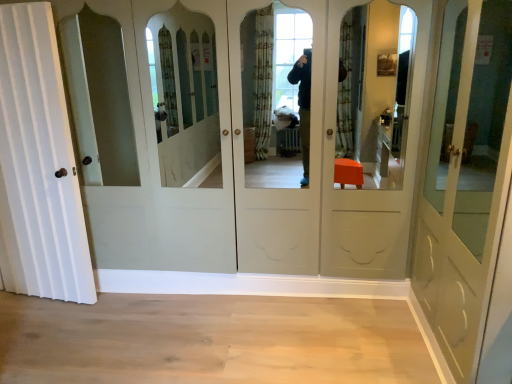
You are a GUI agent. You are given a task and a screenshot of the screen. Output one action in this format:
    pyautogui.click(x=<x>, y=<y>)
    Task: Click on the white wood door at left, placed as the 1th door when sorted from left to right
    
    Given the screenshot: What is the action you would take?
    pyautogui.click(x=38, y=165)

This screenshot has height=384, width=512. What do you see at coordinates (38, 165) in the screenshot? I see `white wood door at left, the second door from the right` at bounding box center [38, 165].

What is the approximate width of white wood door at left, placed as the 1th door when sorted from left to right?

The width of white wood door at left, placed as the 1th door when sorted from left to right, is 7.27 inches.

At what (x,y) coordinates should I click in order to perform the action: click on matte white door at right, the 2th door positioned from the left. Please return your answer as a coordinate pair (x, y). Image resolution: width=512 pixels, height=384 pixels. Looking at the image, I should click on (465, 179).

Looking at this image, how much space does matte white door at right, which is counted as the first door, starting from the right, occupy vertically?

6.21 feet.

Image resolution: width=512 pixels, height=384 pixels. Describe the element at coordinates (465, 179) in the screenshot. I see `matte white door at right, which is counted as the first door, starting from the right` at that location.

Measure the distance between matte white door at right, the 2th door positioned from the left, and camera.

matte white door at right, the 2th door positioned from the left, is 4.78 feet away from camera.

Find the location of a particular element. The height and width of the screenshot is (384, 512). white wood door at left, the second door from the right is located at coordinates (38, 165).

Considering the positions of objects matte white door at right, the 2th door positioned from the left, and white wood door at left, the second door from the right, in the image provided, who is more to the left, matte white door at right, the 2th door positioned from the left, or white wood door at left, the second door from the right,?

white wood door at left, the second door from the right.

Consider the image. Considering the relative positions of matte white door at right, the 2th door positioned from the left, and white wood door at left, placed as the 1th door when sorted from left to right, in the image provided, is matte white door at right, the 2th door positioned from the left, behind white wood door at left, placed as the 1th door when sorted from left to right,?

No, matte white door at right, the 2th door positioned from the left, is in front of white wood door at left, placed as the 1th door when sorted from left to right.

Considering the positions of point (478, 157) and point (17, 122), is point (478, 157) closer or farther from the camera than point (17, 122)?

Point (478, 157) is closer to the camera than point (17, 122).

From the image's perspective, relative to white wood door at left, placed as the 1th door when sorted from left to right, is matte white door at right, the 2th door positioned from the left, above or below?

matte white door at right, the 2th door positioned from the left, is below white wood door at left, placed as the 1th door when sorted from left to right.

From a real-world perspective, is matte white door at right, the 2th door positioned from the left, located beneath white wood door at left, the second door from the right?

No.

Considering the sizes of matte white door at right, the 2th door positioned from the left, and white wood door at left, the second door from the right, in the image, is matte white door at right, the 2th door positioned from the left, wider or thinner than white wood door at left, the second door from the right,?

Clearly, matte white door at right, the 2th door positioned from the left, has more width compared to white wood door at left, the second door from the right.

Consider the image. Considering the sizes of objects matte white door at right, which is counted as the first door, starting from the right, and white wood door at left, the second door from the right, in the image provided, who is shorter, matte white door at right, which is counted as the first door, starting from the right, or white wood door at left, the second door from the right,?

With less height is matte white door at right, which is counted as the first door, starting from the right.

Considering the relative sizes of matte white door at right, which is counted as the first door, starting from the right, and white wood door at left, placed as the 1th door when sorted from left to right, in the image provided, is matte white door at right, which is counted as the first door, starting from the right, bigger than white wood door at left, placed as the 1th door when sorted from left to right,?

Indeed, matte white door at right, which is counted as the first door, starting from the right, has a larger size compared to white wood door at left, placed as the 1th door when sorted from left to right.

Is matte white door at right, which is counted as the first door, starting from the right, outside of white wood door at left, the second door from the right?

That's correct, matte white door at right, which is counted as the first door, starting from the right, is outside of white wood door at left, the second door from the right.

Is matte white door at right, which is counted as the first door, starting from the right, not close to white wood door at left, the second door from the right?

Yes, matte white door at right, which is counted as the first door, starting from the right, and white wood door at left, the second door from the right, are located far from each other.

Is matte white door at right, which is counted as the first door, starting from the right, aimed at white wood door at left, placed as the 1th door when sorted from left to right?

Yes, matte white door at right, which is counted as the first door, starting from the right, faces towards white wood door at left, placed as the 1th door when sorted from left to right.

How different are the orientations of matte white door at right, the 2th door positioned from the left, and white wood door at left, the second door from the right, in degrees?

79.9 degrees separate the facing orientations of matte white door at right, the 2th door positioned from the left, and white wood door at left, the second door from the right.

Identify the location of door below the white wood door at left, placed as the 1th door when sorted from left to right (from the image's perspective). (465, 179).

Is white wood door at left, placed as the 1th door when sorted from left to right, at the right side of matte white door at right, which is counted as the first door, starting from the right?

Incorrect, white wood door at left, placed as the 1th door when sorted from left to right, is not on the right side of matte white door at right, which is counted as the first door, starting from the right.

Is white wood door at left, placed as the 1th door when sorted from left to right, closer to the viewer compared to matte white door at right, the 2th door positioned from the left?

No, the depth of white wood door at left, placed as the 1th door when sorted from left to right, is greater than that of matte white door at right, the 2th door positioned from the left.

Is point (12, 113) closer or farther from the camera than point (462, 343)?

Point (12, 113) is farther from the camera than point (462, 343).

From the image's perspective, which one is positioned lower, white wood door at left, the second door from the right, or matte white door at right, which is counted as the first door, starting from the right?

matte white door at right, which is counted as the first door, starting from the right, is shown below in the image.

From a real-world perspective, is white wood door at left, the second door from the right, under matte white door at right, which is counted as the first door, starting from the right?

Indeed, from a real-world perspective, white wood door at left, the second door from the right, is positioned beneath matte white door at right, which is counted as the first door, starting from the right.

Is white wood door at left, placed as the 1th door when sorted from left to right, thinner than matte white door at right, the 2th door positioned from the left?

Yes, white wood door at left, placed as the 1th door when sorted from left to right, is thinner than matte white door at right, the 2th door positioned from the left.

Considering the relative sizes of white wood door at left, the second door from the right, and matte white door at right, the 2th door positioned from the left, in the image provided, is white wood door at left, the second door from the right, taller than matte white door at right, the 2th door positioned from the left,?

Yes, white wood door at left, the second door from the right, is taller than matte white door at right, the 2th door positioned from the left.

Between white wood door at left, the second door from the right, and matte white door at right, which is counted as the first door, starting from the right, which one has smaller size?

With smaller size is white wood door at left, the second door from the right.

Would you say white wood door at left, the second door from the right, contains matte white door at right, which is counted as the first door, starting from the right?

Definitely not — matte white door at right, which is counted as the first door, starting from the right, is not inside white wood door at left, the second door from the right.

Is white wood door at left, the second door from the right, next to matte white door at right, the 2th door positioned from the left, and touching it?

No, white wood door at left, the second door from the right, is not next to matte white door at right, the 2th door positioned from the left.

In the scene shown: Is white wood door at left, placed as the 1th door when sorted from left to right, oriented towards matte white door at right, the 2th door positioned from the left?

No, white wood door at left, placed as the 1th door when sorted from left to right, is not facing towards matte white door at right, the 2th door positioned from the left.

What's the angular difference between white wood door at left, the second door from the right, and matte white door at right, the 2th door positioned from the left,'s facing directions?

The angle between the facing direction of white wood door at left, the second door from the right, and the facing direction of matte white door at right, the 2th door positioned from the left, is 79.9 degrees.

Locate an element on the screen. The width and height of the screenshot is (512, 384). door lying on the right of white wood door at left, placed as the 1th door when sorted from left to right is located at coordinates (465, 179).

The width and height of the screenshot is (512, 384). Find the location of `door below the white wood door at left, placed as the 1th door when sorted from left to right (from the image's perspective)`. door below the white wood door at left, placed as the 1th door when sorted from left to right (from the image's perspective) is located at coordinates (465, 179).

I want to click on door on the right of white wood door at left, the second door from the right, so click(465, 179).